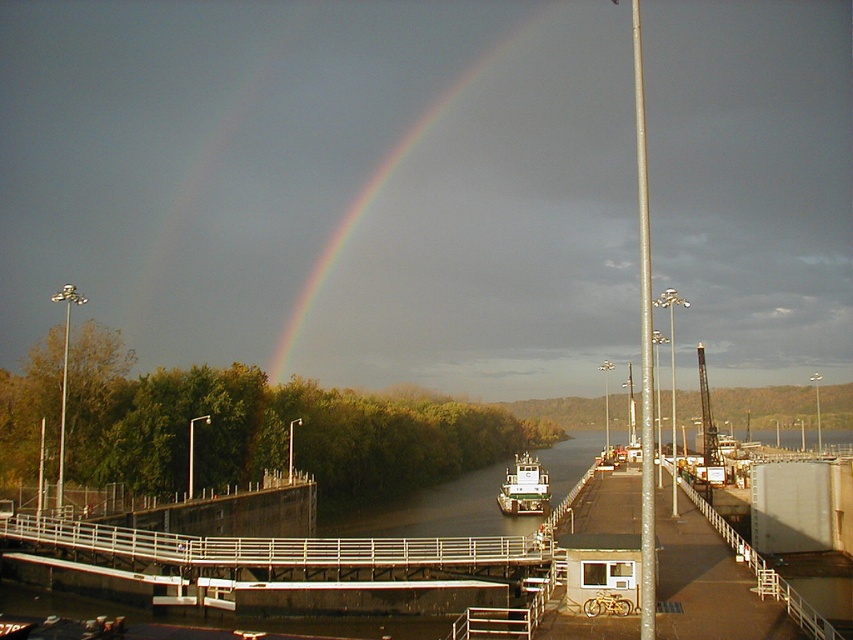
What do you see at coordinates (379, 192) in the screenshot?
I see `rainbow at upper center` at bounding box center [379, 192].

The height and width of the screenshot is (640, 853). Find the location of `rainbow at upper center`. rainbow at upper center is located at coordinates (379, 192).